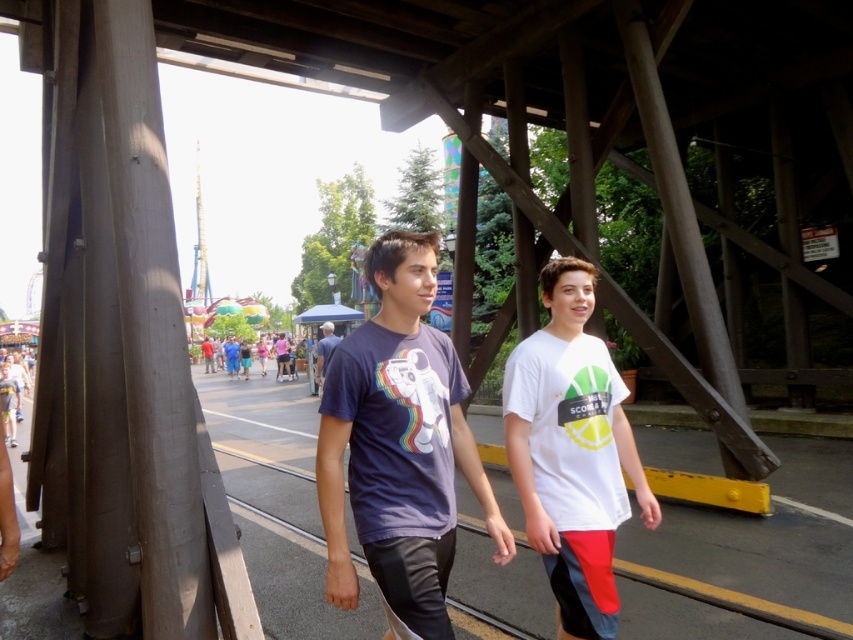
Question: Estimate the real-world distances between objects in this image. Which object is farther from the blue denim jeans at center?

Choices:
 (A) matte purple t-shirt at center
 (B) matte purple shirt at center
 (C) white matte t-shirt at center

Answer: (B)

Question: Among these points, which one is farthest from the camera?

Choices:
 (A) (434, 580)
 (B) (230, 364)
 (C) (590, 509)
 (D) (335, 336)

Answer: (B)

Question: Is matte purple t-shirt at center thinner than blue denim jeans at center?

Choices:
 (A) yes
 (B) no

Answer: (B)

Question: Can you confirm if white matte t-shirt at center is positioned above blue denim jeans at center?

Choices:
 (A) no
 (B) yes

Answer: (A)

Question: Which point is closer to the camera taking this photo?

Choices:
 (A) (248, 353)
 (B) (316, 371)
 (C) (450, 493)
 (D) (509, 420)

Answer: (C)

Question: Is matte purple t-shirt at center to the left of matte purple shirt at center from the viewer's perspective?

Choices:
 (A) yes
 (B) no

Answer: (B)